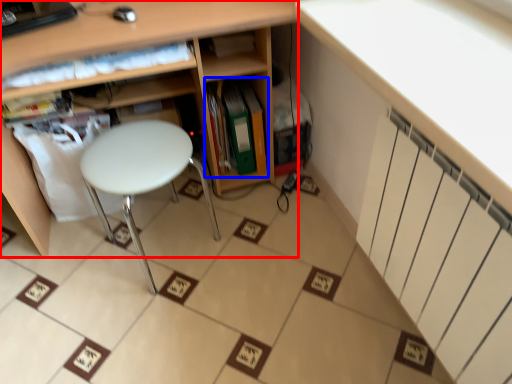
Question: Which of the following is the closest to the observer, shelf (highlighted by a red box) or book (highlighted by a blue box)?

Choices:
 (A) shelf
 (B) book

Answer: (A)